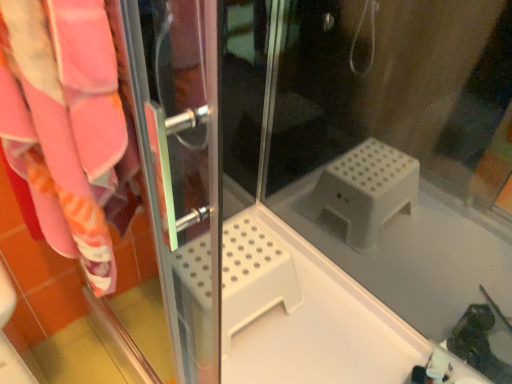
You are a GUI agent. You are given a task and a screenshot of the screen. Output one action in this format:
    pyautogui.click(x=<x>, y=<y>)
    Task: Click on the transparent plastic step stool at center
    The width and height of the screenshot is (512, 384).
    Given the screenshot: What is the action you would take?
    pyautogui.click(x=385, y=148)

Describe the element at coordinates (385, 148) in the screenshot. I see `transparent plastic step stool at center` at that location.

The width and height of the screenshot is (512, 384). Describe the element at coordinates (106, 166) in the screenshot. I see `transparent plastic screen door at left` at that location.

I want to click on transparent plastic screen door at left, so click(x=106, y=166).

At what (x,y) coordinates should I click in order to perform the action: click on transparent plastic step stool at center. Please return your answer as a coordinate pair (x, y). Looking at the image, I should click on (385, 148).

In the image, is transparent plastic step stool at center on the left side or the right side of transparent plastic screen door at left?

Based on their positions, transparent plastic step stool at center is located to the right of transparent plastic screen door at left.

Does transparent plastic step stool at center come behind transparent plastic screen door at left?

Yes, transparent plastic step stool at center is further from the viewer.

Considering the points (490, 209) and (80, 77), which point is behind, point (490, 209) or point (80, 77)?

The point (490, 209) is behind.

From the image's perspective, which is below, transparent plastic step stool at center or transparent plastic screen door at left?

transparent plastic screen door at left appears lower in the image.

From a real-world perspective, relative to transparent plastic screen door at left, is transparent plastic step stool at center vertically above or below?

transparent plastic step stool at center is situated lower than transparent plastic screen door at left in the real world.

Which object is wider, transparent plastic step stool at center or transparent plastic screen door at left?

transparent plastic step stool at center is wider.

Considering the relative sizes of transparent plastic step stool at center and transparent plastic screen door at left in the image provided, is transparent plastic step stool at center shorter than transparent plastic screen door at left?

No, transparent plastic step stool at center is not shorter than transparent plastic screen door at left.

Does transparent plastic step stool at center have a smaller size compared to transparent plastic screen door at left?

Actually, transparent plastic step stool at center might be larger than transparent plastic screen door at left.

Is transparent plastic screen door at left located within transparent plastic step stool at center?

No, transparent plastic screen door at left is not inside transparent plastic step stool at center.

Is transparent plastic step stool at center far from transparent plastic screen door at left?

transparent plastic step stool at center is actually quite close to transparent plastic screen door at left.

Is transparent plastic step stool at center facing towards transparent plastic screen door at left?

No.

How distant is transparent plastic step stool at center from transparent plastic screen door at left?

A distance of 33.42 inches exists between transparent plastic step stool at center and transparent plastic screen door at left.

Locate an element on the screen. glass door beneath the transparent plastic screen door at left (from a real-world perspective) is located at coordinates (385, 148).

Is transparent plastic screen door at left at the right side of transparent plastic step stool at center?

Incorrect, transparent plastic screen door at left is not on the right side of transparent plastic step stool at center.

Considering the relative positions of transparent plastic screen door at left and transparent plastic step stool at center in the image provided, is transparent plastic screen door at left behind transparent plastic step stool at center?

No, transparent plastic screen door at left is closer to the viewer.

Considering the positions of point (138, 171) and point (241, 53), is point (138, 171) closer or farther from the camera than point (241, 53)?

Point (138, 171) is closer to the camera than point (241, 53).

From the image's perspective, relative to transparent plastic step stool at center, is transparent plastic screen door at left above or below?

transparent plastic screen door at left is below transparent plastic step stool at center.

From a real-world perspective, which object rests below the other?

transparent plastic step stool at center.

Considering the relative sizes of transparent plastic screen door at left and transparent plastic step stool at center in the image provided, is transparent plastic screen door at left wider than transparent plastic step stool at center?

In fact, transparent plastic screen door at left might be narrower than transparent plastic step stool at center.

Between transparent plastic screen door at left and transparent plastic step stool at center, which one has less height?

Standing shorter between the two is transparent plastic screen door at left.

Is transparent plastic screen door at left bigger or smaller than transparent plastic step stool at center?

transparent plastic screen door at left is smaller than transparent plastic step stool at center.

Is transparent plastic screen door at left positioned beyond the bounds of transparent plastic step stool at center?

Yes, transparent plastic screen door at left is outside of transparent plastic step stool at center.

Can you see transparent plastic screen door at left touching transparent plastic step stool at center?

No, transparent plastic screen door at left is not beside transparent plastic step stool at center.

Is transparent plastic screen door at left positioned with its back to transparent plastic step stool at center?

No, transparent plastic screen door at left is not facing the opposite direction of transparent plastic step stool at center.

The image size is (512, 384). I want to click on screen door positioned vertically above the transparent plastic step stool at center (from a real-world perspective), so click(x=106, y=166).

The image size is (512, 384). What are the coordinates of `screen door that is on the left side of transparent plastic step stool at center` in the screenshot? It's located at (106, 166).

Where is `glass door beneath the transparent plastic screen door at left (from a real-world perspective)`? The image size is (512, 384). glass door beneath the transparent plastic screen door at left (from a real-world perspective) is located at coordinates (385, 148).